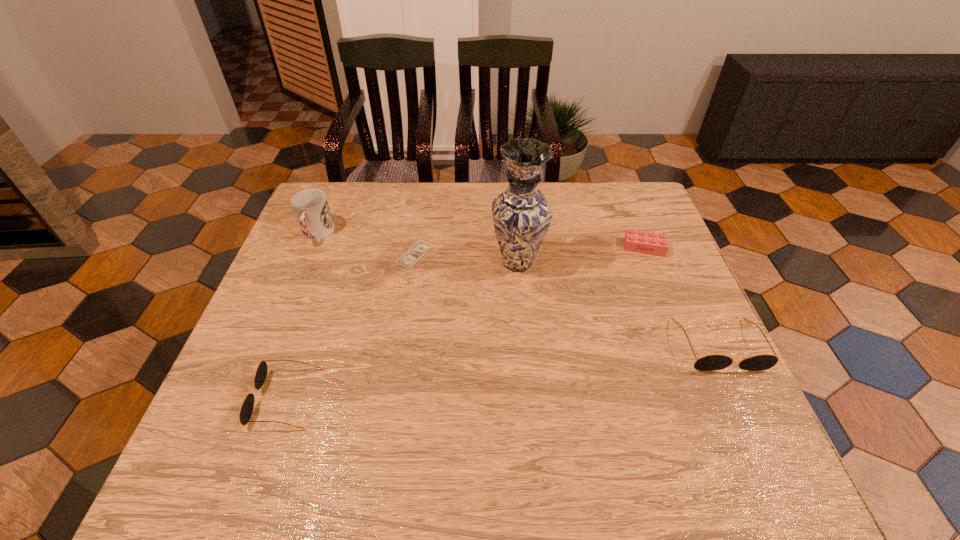
At what (x,y) coordinates should I click in order to perform the action: click on free space that satisfies the following two spatial constraints: 1. on the front-facing side of the right sunglasses; 2. on the front-facing side of the left sunglasses. Please return your answer as a coordinate pair (x, y). Image resolution: width=960 pixels, height=540 pixels. Looking at the image, I should click on (743, 398).

This screenshot has width=960, height=540. Identify the location of free space that satisfies the following two spatial constraints: 1. on the front side of the vase; 2. on the right side of the money. (414, 262).

The image size is (960, 540). I want to click on free point that satisfies the following two spatial constraints: 1. on the side of the cup where the handle is located; 2. on the left side of the Lego, so click(311, 247).

This screenshot has width=960, height=540. Identify the location of free space that satisfies the following two spatial constraints: 1. on the side of the money where the handle is located; 2. on the right side of the cup. (308, 254).

Where is `blank space that satisfies the following two spatial constraints: 1. on the side of the fifth shortest object where the handle is located; 2. on the right side of the Lego`? The image size is (960, 540). blank space that satisfies the following two spatial constraints: 1. on the side of the fifth shortest object where the handle is located; 2. on the right side of the Lego is located at coordinates (311, 247).

You are a GUI agent. You are given a task and a screenshot of the screen. Output one action in this format:
    pyautogui.click(x=<x>, y=<y>)
    Task: Click on the vacant region that satisfies the following two spatial constraints: 1. on the back side of the second shortest object; 2. on the left side of the fourth object from right to left
    Image resolution: width=960 pixels, height=540 pixels.
    Given the screenshot: What is the action you would take?
    pyautogui.click(x=416, y=247)

What are the coordinates of `free spot that satisfies the following two spatial constraints: 1. on the side of the money where the handle is located; 2. on the left side of the cup` in the screenshot? It's located at (308, 254).

The image size is (960, 540). Identify the location of vacant space that satisfies the following two spatial constraints: 1. on the side of the vase where the handle is located; 2. on the right side of the second tallest object. (304, 262).

Where is `vacant space that satisfies the following two spatial constraints: 1. on the side of the cup where the handle is located; 2. on the right side of the fourth object from right to left`? Image resolution: width=960 pixels, height=540 pixels. vacant space that satisfies the following two spatial constraints: 1. on the side of the cup where the handle is located; 2. on the right side of the fourth object from right to left is located at coordinates (308, 254).